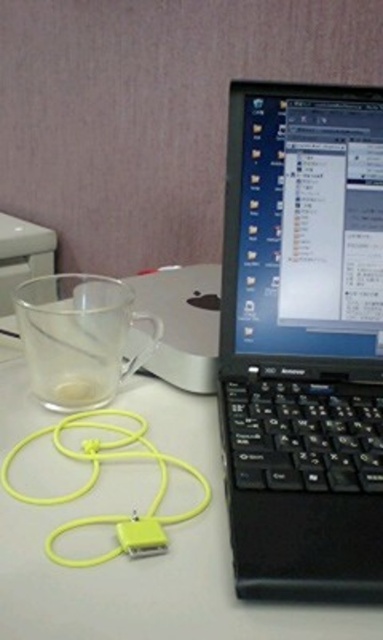
You are standing at a distance of 30 centimeters from the desk. Can you reach the transparent glass at upper left without moving your position?

The transparent glass at upper left is 31.28 centimeters away from the viewer. Since you are standing at 30 centimeters from the desk, you cannot reach it without moving closer.

You are organizing your desk and want to place a new item between the black plastic laptop at center and the transparent glass cup at left. Considering their sizes, which object should you move to make space?

Since the black plastic laptop at center is larger than the transparent glass cup at left, you should move the transparent glass cup at left to create more space for the new item.

You are standing 36.91 centimeters away from the point at coordinates (245, 524). If you want to place a 20 cm wide book on the desk without moving any existing items, will there be enough space?

The point at coordinates (245, 524) is 36.91 centimeters away from you. Since the book is only 20 cm wide, there should be enough space to place it there without moving existing items.